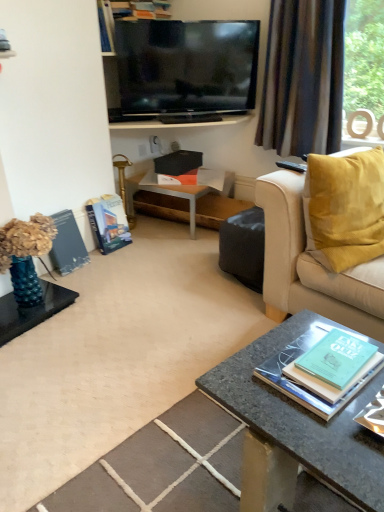
Where is `free space above green matte book at lower right, which is counted as the 2th book, starting from the back (from a real-world perspective)`? This screenshot has height=512, width=384. free space above green matte book at lower right, which is counted as the 2th book, starting from the back (from a real-world perspective) is located at coordinates (326, 358).